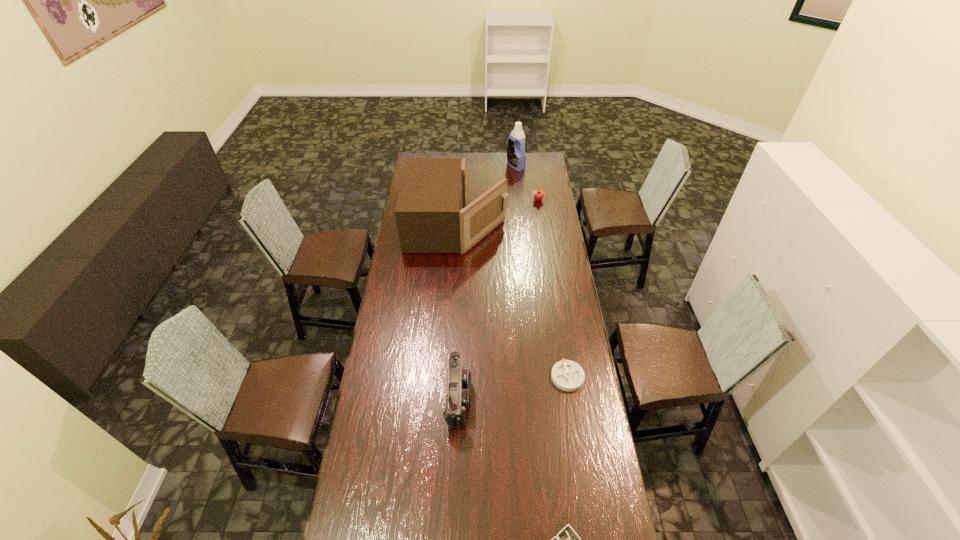
Where is `object situated at the far edge`? The width and height of the screenshot is (960, 540). object situated at the far edge is located at coordinates (516, 158).

At what (x,y) coordinates should I click in order to perform the action: click on object that is at the left edge. Please return your answer as a coordinate pair (x, y). The width and height of the screenshot is (960, 540). Looking at the image, I should click on (432, 217).

Find the location of a particular element. detergent at the right edge is located at coordinates (516, 158).

The width and height of the screenshot is (960, 540). In order to click on apple present at the right edge in this screenshot , I will do `click(538, 194)`.

Where is `ashtray that is at the right edge`? This screenshot has height=540, width=960. ashtray that is at the right edge is located at coordinates (567, 375).

I want to click on object at the far right corner, so click(x=516, y=158).

Locate an element on the screen. Image resolution: width=960 pixels, height=540 pixels. vacant space at the far edge of the desktop is located at coordinates (489, 153).

Where is `free spot at the left edge of the desktop`? This screenshot has height=540, width=960. free spot at the left edge of the desktop is located at coordinates (394, 275).

At what (x,y) coordinates should I click in order to perform the action: click on vacant space at the right edge of the desktop. Please return your answer as a coordinate pair (x, y). The width and height of the screenshot is (960, 540). Looking at the image, I should click on (552, 292).

Locate an element on the screen. free space at the far right corner of the desktop is located at coordinates (543, 167).